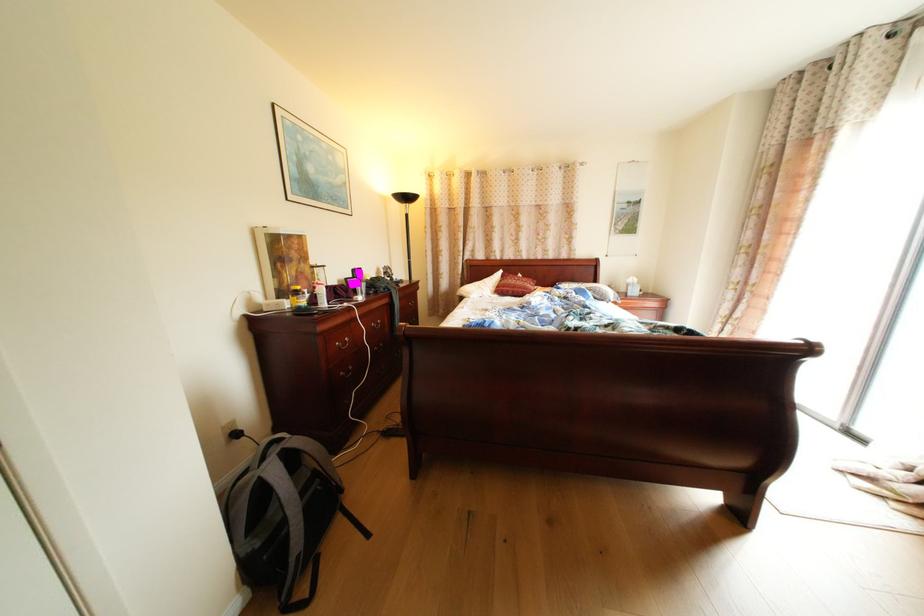
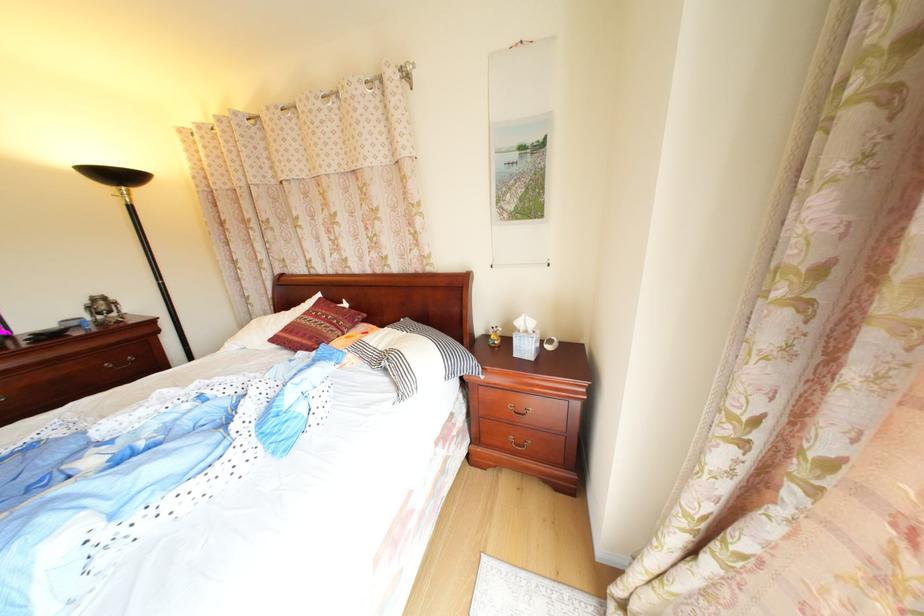
The point at (641, 296) is marked in the first image. Where is the corresponding point in the second image?

(529, 357)